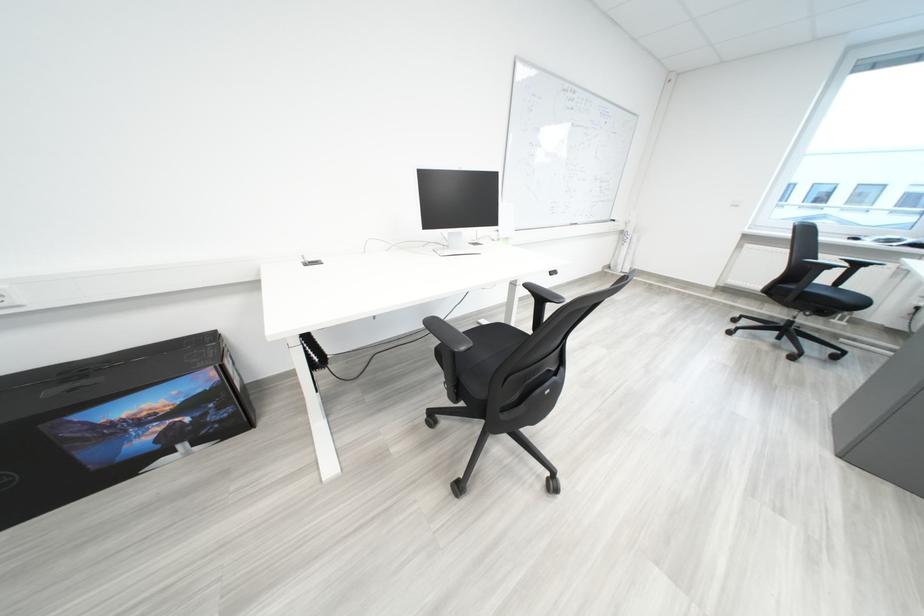
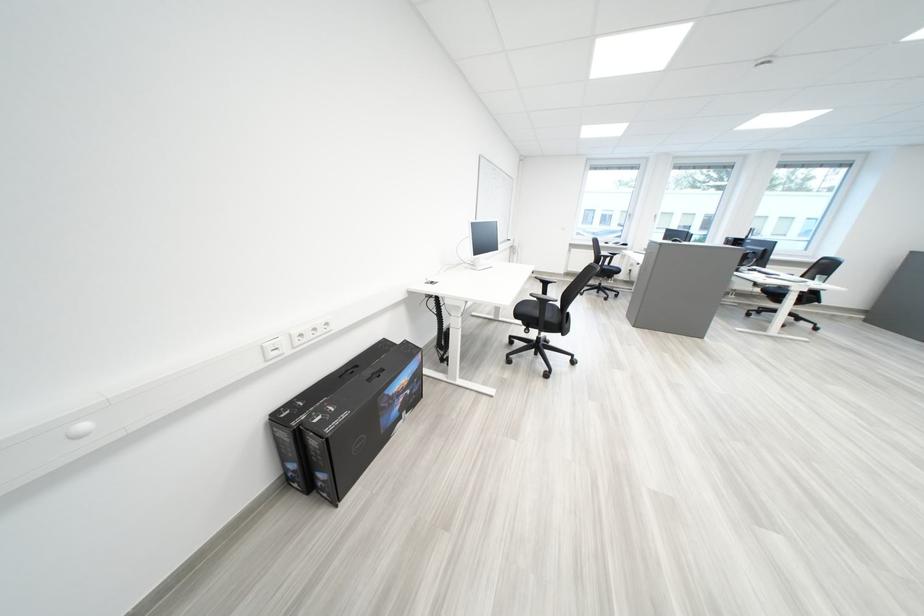
In the second image, find the point that corresponds to (x=155, y=423) in the first image.

(411, 395)